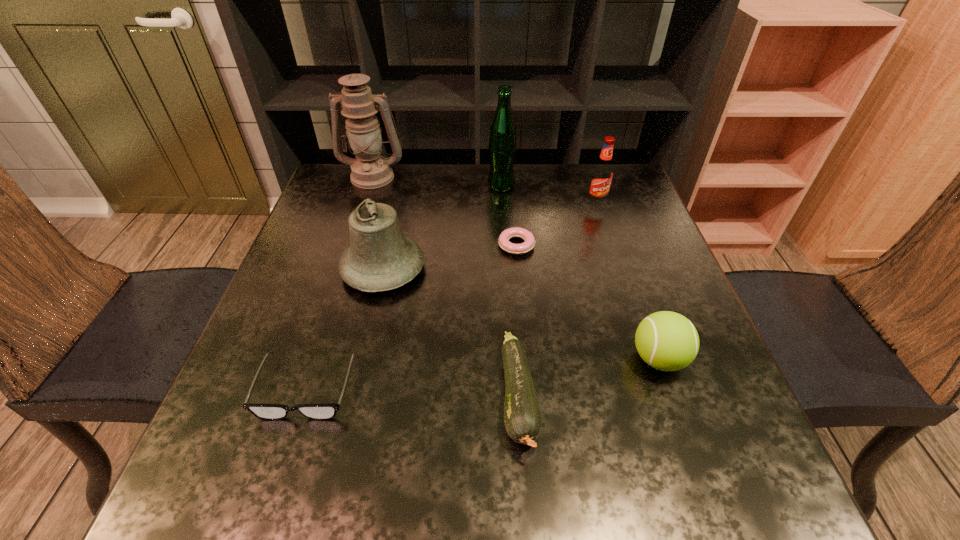
Identify the location of unoccupied area between the root beer and the tennis ball. (627, 281).

At what (x,y) coordinates should I click in order to perform the action: click on free space between the spectacles and the bell. Please return your answer as a coordinate pair (x, y). The image size is (960, 540). Looking at the image, I should click on (345, 328).

The image size is (960, 540). What are the coordinates of `blank region between the fifth tallest object and the zucchini` in the screenshot? It's located at click(x=588, y=378).

Choose which object is the seventh nearest neighbor to the doughnut. Please provide its 2D coordinates. Your answer should be formatted as a tuple, i.e. [(x, y)], where the tuple contains the x and y coordinates of a point satisfying the conditions above.

[(327, 411)]

The image size is (960, 540). I want to click on object identified as the seventh closest to the oil lamp, so click(x=668, y=341).

Where is `free space that satisfies the following two spatial constraints: 1. on the front side of the fifth tallest object; 2. on the right side of the beer bottle`? This screenshot has height=540, width=960. free space that satisfies the following two spatial constraints: 1. on the front side of the fifth tallest object; 2. on the right side of the beer bottle is located at coordinates (512, 359).

This screenshot has height=540, width=960. Identify the location of free space that satisfies the following two spatial constraints: 1. on the back side of the third farthest object; 2. on the right side of the bell. (398, 204).

Identify the location of free space that satisfies the following two spatial constraints: 1. on the front side of the sixth nearest object; 2. on the right side of the oil lamp. (364, 204).